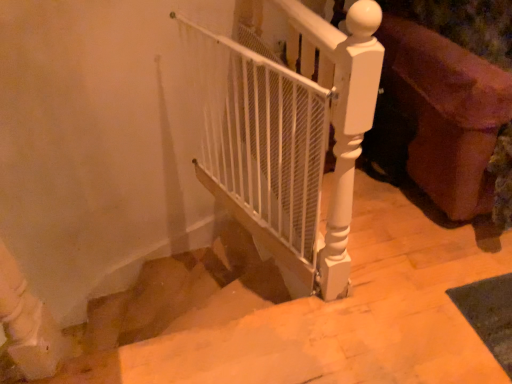
Identify the location of velvet purple sofa at right. The width and height of the screenshot is (512, 384). (450, 120).

The image size is (512, 384). Find the location of `white mesh gate at center`. white mesh gate at center is located at coordinates (288, 131).

What do you see at coordinates (173, 302) in the screenshot?
I see `smooth beige stairs at center` at bounding box center [173, 302].

The image size is (512, 384). What are the coordinates of `velvet purple sofa at right` in the screenshot? It's located at (450, 120).

Looking at this image, considering the positions of objects smooth beige stairs at center and smooth beige stairs at center in the image provided, who is more to the left, smooth beige stairs at center or smooth beige stairs at center?

Positioned to the left is smooth beige stairs at center.

Based on the photo, which of these two, smooth beige stairs at center or smooth beige stairs at center, is thinner?

Thinner between the two is smooth beige stairs at center.

Is the position of smooth beige stairs at center less distant than that of smooth beige stairs at center?

→ Yes, it is in front of smooth beige stairs at center.

From the image's perspective, which is above, smooth beige stairs at center or smooth beige stairs at center?

From the image's view, smooth beige stairs at center is above.

Is smooth beige stairs at center far from smooth beige stairs at center?

No.

From the image's perspective, relative to smooth beige stairs at center, is smooth beige stairs at center above or below?

smooth beige stairs at center is situated lower than smooth beige stairs at center in the image.

Based on the photo, measure the distance from velvet purple sofa at right to white mesh gate at center.

A distance of 24.28 inches exists between velvet purple sofa at right and white mesh gate at center.

Which of these two, velvet purple sofa at right or white mesh gate at center, stands shorter?

With less height is white mesh gate at center.

Is velvet purple sofa at right to the left of white mesh gate at center from the viewer's perspective?

In fact, velvet purple sofa at right is to the right of white mesh gate at center.

Which of these two, velvet purple sofa at right or white mesh gate at center, is bigger?

Bigger between the two is velvet purple sofa at right.

Is white mesh gate at center smaller than smooth beige stairs at center?

No, white mesh gate at center is not smaller than smooth beige stairs at center.

Which object is wider, white mesh gate at center or smooth beige stairs at center?

With larger width is smooth beige stairs at center.

Considering the positions of objects white mesh gate at center and smooth beige stairs at center in the image provided, who is more to the right, white mesh gate at center or smooth beige stairs at center?

Result: smooth beige stairs at center.

From the image's perspective, between white mesh gate at center and smooth beige stairs at center, who is located below?

From the image's view, smooth beige stairs at center is below.

Would you consider smooth beige stairs at center to be distant from velvet purple sofa at right?

Indeed, smooth beige stairs at center is not near velvet purple sofa at right.

Between smooth beige stairs at center and velvet purple sofa at right, which one has smaller size?

smooth beige stairs at center is smaller.

In order to click on stairwell behind the velvet purple sofa at right in this screenshot , I will do `click(173, 302)`.

Can you confirm if smooth beige stairs at center is positioned to the left of velvet purple sofa at right?

Yes, smooth beige stairs at center is to the left of velvet purple sofa at right.

In the scene shown: Looking at their sizes, would you say velvet purple sofa at right is wider or thinner than smooth beige stairs at center?

Clearly, velvet purple sofa at right has less width compared to smooth beige stairs at center.

Can you tell me how much velvet purple sofa at right and smooth beige stairs at center differ in facing direction?

velvet purple sofa at right and smooth beige stairs at center are facing 90.5 degrees away from each other.

Between velvet purple sofa at right and smooth beige stairs at center, which one appears on the left side from the viewer's perspective?

smooth beige stairs at center.

Is velvet purple sofa at right taller than smooth beige stairs at center?

Indeed, velvet purple sofa at right has a greater height compared to smooth beige stairs at center.

Would you consider white mesh gate at center to be distant from velvet purple sofa at right?

They are positioned close to each other.

This screenshot has height=384, width=512. What are the coordinates of `fence that is under the velvet purple sofa at right (from a real-world perspective)` in the screenshot? It's located at (288, 131).

From a real-world perspective, is white mesh gate at center positioned over velvet purple sofa at right based on gravity?

No, from a real-world perspective, white mesh gate at center is not on top of velvet purple sofa at right.

Considering the relative positions of white mesh gate at center and velvet purple sofa at right in the image provided, is white mesh gate at center in front of velvet purple sofa at right?

No, white mesh gate at center is behind velvet purple sofa at right.

Locate an element on the screen. stairwell beneath the smooth beige stairs at center (from a real-world perspective) is located at coordinates (173, 302).

Identify the location of stairwell lying on the left of smooth beige stairs at center. (173, 302).

From the image, which object appears to be farther from velvet purple sofa at right, white mesh gate at center or smooth beige stairs at center?

smooth beige stairs at center lies further to velvet purple sofa at right than the other object.

Considering their positions, is smooth beige stairs at center positioned further to velvet purple sofa at right than smooth beige stairs at center?

smooth beige stairs at center is positioned further to the anchor velvet purple sofa at right.

From the image, which object appears to be farther from velvet purple sofa at right, white mesh gate at center or smooth beige stairs at center?

white mesh gate at center.

Consider the image. When comparing their distances from smooth beige stairs at center, does smooth beige stairs at center or velvet purple sofa at right seem further?

The object further to smooth beige stairs at center is smooth beige stairs at center.

When comparing their distances from white mesh gate at center, does smooth beige stairs at center or smooth beige stairs at center seem further?

smooth beige stairs at center.

Estimate the real-world distances between objects in this image. Which object is closer to smooth beige stairs at center, smooth beige stairs at center or white mesh gate at center?

white mesh gate at center lies closer to smooth beige stairs at center than the other object.

Looking at the image, which one is located further to white mesh gate at center, velvet purple sofa at right or smooth beige stairs at center?

smooth beige stairs at center.

Based on their spatial positions, is velvet purple sofa at right or smooth beige stairs at center further from smooth beige stairs at center?

Based on the image, velvet purple sofa at right appears to be further to smooth beige stairs at center.

At what (x,y) coordinates should I click in order to perform the action: click on fence between smooth beige stairs at center and velvet purple sofa at right in the horizontal direction. Please return your answer as a coordinate pair (x, y). This screenshot has height=384, width=512. Looking at the image, I should click on (288, 131).

What are the coordinates of `stairs between white mesh gate at center and velvet purple sofa at right from left to right` in the screenshot? It's located at (303, 312).

This screenshot has width=512, height=384. What are the coordinates of `stairs located between smooth beige stairs at center and velvet purple sofa at right in the left-right direction` in the screenshot? It's located at (303, 312).

Identify the location of stairs between white mesh gate at center and smooth beige stairs at center vertically. The width and height of the screenshot is (512, 384). (303, 312).